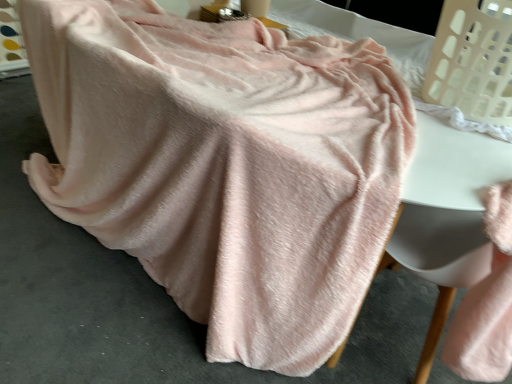
Describe the element at coordinates (473, 60) in the screenshot. I see `white plastic laundry basket at upper right` at that location.

At what (x,y) coordinates should I click in order to perform the action: click on white plastic laundry basket at upper right. Please return your answer as a coordinate pair (x, y). The height and width of the screenshot is (384, 512). Looking at the image, I should click on (473, 60).

The height and width of the screenshot is (384, 512). What do you see at coordinates (438, 259) in the screenshot? I see `soft pink fabric at lower right` at bounding box center [438, 259].

Identify the location of soft pink fabric at lower right. (438, 259).

Identify the location of white plastic laundry basket at upper right. The image size is (512, 384). (473, 60).

Is white plastic laundry basket at upper right at the left side of soft pink fabric at lower right?

In fact, white plastic laundry basket at upper right is to the right of soft pink fabric at lower right.

In the image, is white plastic laundry basket at upper right positioned in front of or behind soft pink fabric at lower right?

white plastic laundry basket at upper right is positioned farther from the viewer than soft pink fabric at lower right.

Which is farther from the camera, [443,22] or [455,216]?

Positioned behind is point [455,216].

From the image's perspective, is white plastic laundry basket at upper right on top of soft pink fabric at lower right?

Yes, from the image's perspective, white plastic laundry basket at upper right is over soft pink fabric at lower right.

From a real-world perspective, is white plastic laundry basket at upper right located higher than soft pink fabric at lower right?

Correct, in the physical world, white plastic laundry basket at upper right is higher than soft pink fabric at lower right.

Considering the sizes of objects white plastic laundry basket at upper right and soft pink fabric at lower right in the image provided, who is wider, white plastic laundry basket at upper right or soft pink fabric at lower right?

Wider between the two is white plastic laundry basket at upper right.

Based on the photo, is white plastic laundry basket at upper right taller than soft pink fabric at lower right?

No.

Considering the sizes of white plastic laundry basket at upper right and soft pink fabric at lower right in the image, is white plastic laundry basket at upper right bigger or smaller than soft pink fabric at lower right?

white plastic laundry basket at upper right is smaller than soft pink fabric at lower right.

Is white plastic laundry basket at upper right positioned beyond the bounds of soft pink fabric at lower right?

Yes, white plastic laundry basket at upper right is located beyond the bounds of soft pink fabric at lower right.

Is the surface of white plastic laundry basket at upper right in direct contact with soft pink fabric at lower right?

They are not placed beside each other.

Looking at this image, is soft pink fabric at lower right at the back of white plastic laundry basket at upper right?

No, white plastic laundry basket at upper right's orientation is not away from soft pink fabric at lower right.

Can you tell me how much white plastic laundry basket at upper right and soft pink fabric at lower right differ in facing direction?

The angular difference between white plastic laundry basket at upper right and soft pink fabric at lower right is 94.1 degrees.

I want to click on laundry basket that is above the soft pink fabric at lower right (from a real-world perspective), so click(473, 60).

In the image, is soft pink fabric at lower right on the left side or the right side of white plastic laundry basket at upper right?

Clearly, soft pink fabric at lower right is on the left of white plastic laundry basket at upper right in the image.

Is soft pink fabric at lower right positioned in front of white plastic laundry basket at upper right?

Yes.

Between point (439, 337) and point (492, 10), which one is positioned in front?

The point (492, 10) is closer to the camera.

From the image's perspective, which is below, soft pink fabric at lower right or white plastic laundry basket at upper right?

soft pink fabric at lower right appears lower in the image.

From a real-world perspective, is soft pink fabric at lower right below white plastic laundry basket at upper right?

Correct, in the physical world, soft pink fabric at lower right is lower than white plastic laundry basket at upper right.

In the scene shown: Is soft pink fabric at lower right wider than white plastic laundry basket at upper right?

No, soft pink fabric at lower right is not wider than white plastic laundry basket at upper right.

Who is taller, soft pink fabric at lower right or white plastic laundry basket at upper right?

soft pink fabric at lower right is taller.

Between soft pink fabric at lower right and white plastic laundry basket at upper right, which one has smaller size?

white plastic laundry basket at upper right is smaller.

Can white plastic laundry basket at upper right be found inside soft pink fabric at lower right?

No, soft pink fabric at lower right does not contain white plastic laundry basket at upper right.

Are soft pink fabric at lower right and white plastic laundry basket at upper right far apart?

They are positioned close to each other.

Does soft pink fabric at lower right turn towards white plastic laundry basket at upper right?

No, soft pink fabric at lower right does not turn towards white plastic laundry basket at upper right.

Identify the location of laundry basket to the right of soft pink fabric at lower right. Image resolution: width=512 pixels, height=384 pixels. (473, 60).

Find the location of a particular element. laundry basket lying above the soft pink fabric at lower right (from the image's perspective) is located at coordinates (473, 60).

Where is `swivel chair that appears on the left of white plastic laundry basket at upper right`? The height and width of the screenshot is (384, 512). swivel chair that appears on the left of white plastic laundry basket at upper right is located at coordinates (438, 259).